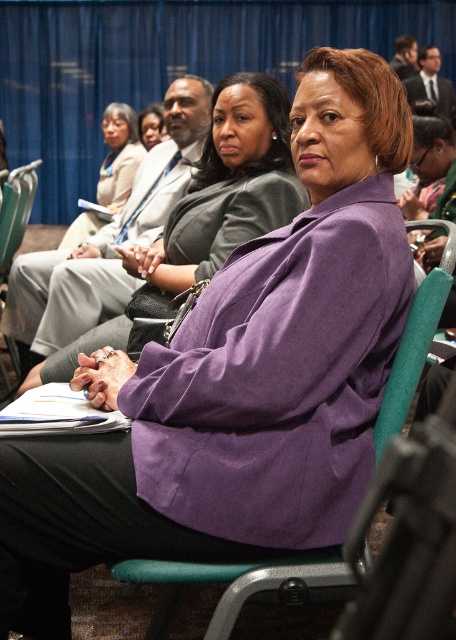
Question: Does matte black blazer at center appear on the right side of matte black suit at upper right?

Choices:
 (A) no
 (B) yes

Answer: (A)

Question: Which object is farther from the camera taking this photo?

Choices:
 (A) teal fabric chair at center
 (B) green fabric chair at left
 (C) matte black blazer at center

Answer: (C)

Question: Can you confirm if purple matte blazer at center is positioned to the left of green fabric chair at left?

Choices:
 (A) yes
 (B) no

Answer: (B)

Question: Can you confirm if green fabric chair at left is positioned to the left of matte black suit at upper right?

Choices:
 (A) yes
 (B) no

Answer: (A)

Question: Which object is farther from the camera taking this photo?

Choices:
 (A) purple matte jacket at center
 (B) green fabric chair at left
 (C) purple matte blazer at center

Answer: (B)

Question: Which point appears closest to the camera in this image?

Choices:
 (A) (217, 113)
 (B) (423, 61)

Answer: (A)